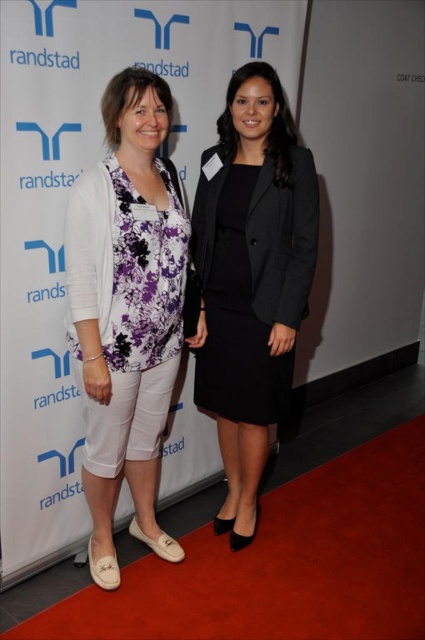
Question: Which is farther from the white floral blouse at center?

Choices:
 (A) black matte blazer at center
 (B) black matte dress at center

Answer: (A)

Question: Which object appears farthest from the camera in this image?

Choices:
 (A) black matte blazer at center
 (B) white floral blouse at center

Answer: (A)

Question: Does white floral blouse at center appear on the right side of black matte dress at center?

Choices:
 (A) yes
 (B) no

Answer: (B)

Question: Observing the image, what is the correct spatial positioning of white floral blouse at center in reference to black matte dress at center?

Choices:
 (A) above
 (B) below

Answer: (B)

Question: Which object is positioned closest to the black matte blazer at center?

Choices:
 (A) white floral blouse at center
 (B) black matte dress at center

Answer: (B)

Question: Is white floral blouse at center to the left of black matte dress at center from the viewer's perspective?

Choices:
 (A) yes
 (B) no

Answer: (A)